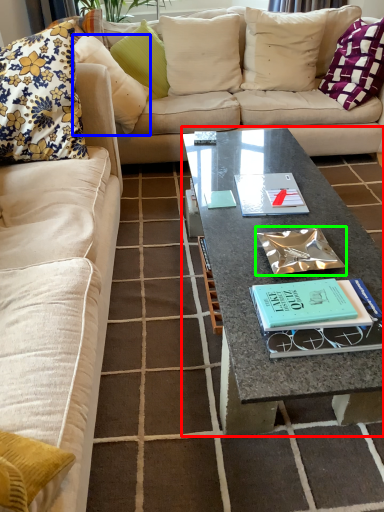
Question: Based on their relative distances, which object is farther from coffee table (highlighted by a red box)? Choose from pillow (highlighted by a blue box) and book (highlighted by a green box).

Choices:
 (A) pillow
 (B) book

Answer: (A)